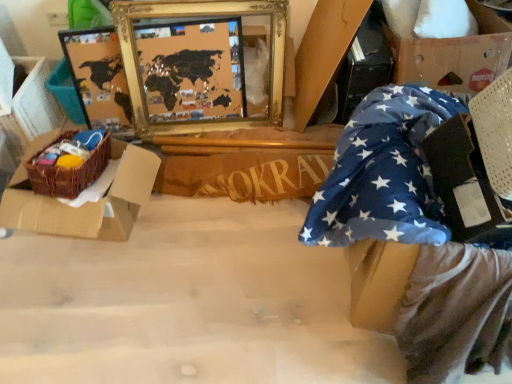
This screenshot has height=384, width=512. Identify the location of vacant area that is in front of wooden sign at center. (243, 245).